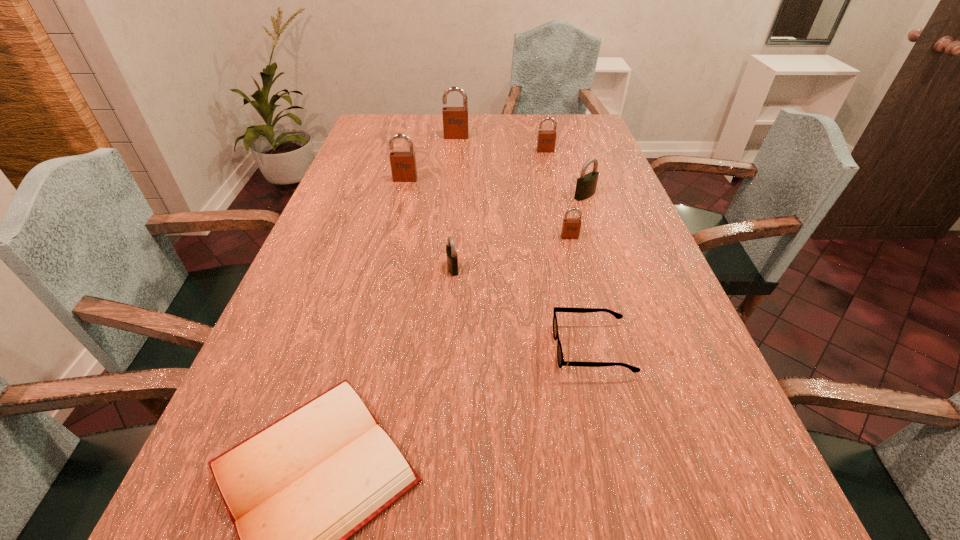
I want to click on vacant space in between the second biggest brown padlock and the bigger black padlock, so click(495, 187).

The width and height of the screenshot is (960, 540). Find the location of `vacant space that's between the farthest object and the third nearest brown padlock`. vacant space that's between the farthest object and the third nearest brown padlock is located at coordinates (501, 144).

At what (x,y) coordinates should I click in order to perform the action: click on free space between the second farthest object and the biggest brown padlock. Please return your answer as a coordinate pair (x, y). This screenshot has width=960, height=540. Looking at the image, I should click on (501, 144).

Locate an element on the screen. This screenshot has height=540, width=960. free spot between the smallest brown padlock and the farthest padlock is located at coordinates (513, 187).

Where is `free point between the spectacles and the leftmost brown padlock`? free point between the spectacles and the leftmost brown padlock is located at coordinates (498, 264).

This screenshot has height=540, width=960. Identify the location of free space between the third nearest padlock and the smallest brown padlock. tap(577, 216).

This screenshot has height=540, width=960. Identify the location of free space between the second farthest brown padlock and the second nearest brown padlock. (475, 165).

You are a GUI agent. You are given a task and a screenshot of the screen. Output one action in this format:
    pyautogui.click(x=<x>, y=<y>)
    Task: Click on the seventh closest object to the smaller black padlock
    The image size is (960, 540).
    Given the screenshot: What is the action you would take?
    pyautogui.click(x=455, y=119)

Find the location of `the sixth closest object to the fourth nearest object`. the sixth closest object to the fourth nearest object is located at coordinates (296, 491).

Where is `the closest padlock to the second farthest padlock`? The image size is (960, 540). the closest padlock to the second farthest padlock is located at coordinates (586, 184).